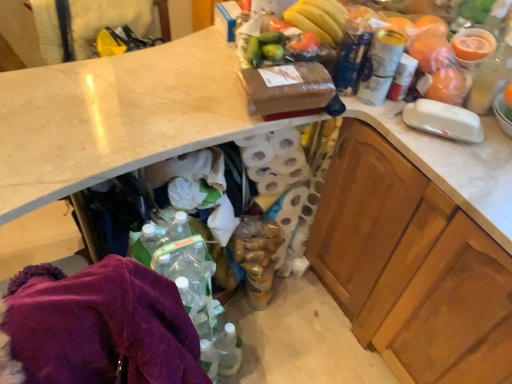
In order to click on metallic silver can at upper right, which is the first bottle from left to right in this screenshot , I will do `click(380, 66)`.

How much space does translucent plastic cup at upper right, arranged as the 1th bottle when viewed from the right, occupy horizontally?

translucent plastic cup at upper right, arranged as the 1th bottle when viewed from the right, is 3.64 inches wide.

Find the location of a particular element. translucent plastic cup at upper right, arranged as the 1th bottle when viewed from the right is located at coordinates (490, 77).

Describe the element at coordinates (318, 19) in the screenshot. The width and height of the screenshot is (512, 384). I see `yellow matte bananas at upper right` at that location.

Find the location of a particular element. metallic silver can at upper right, which is the first bottle from left to right is located at coordinates (380, 66).

Consider the image. Is white marble countertop at lower left facing away from yellow matte bananas at upper right?

No, white marble countertop at lower left's orientation is not away from yellow matte bananas at upper right.

I want to click on banana on the right of white marble countertop at lower left, so [318, 19].

Which is less distant, [251,126] or [329,22]?

The point [251,126] is closer to the camera.

Which of these two, wooden cabinet at right or translucent plastic cup at upper right, arranged as the 1th bottle when viewed from the right, stands shorter?

With less height is translucent plastic cup at upper right, arranged as the 1th bottle when viewed from the right.

Which is correct: wooden cabinet at right is inside translucent plastic cup at upper right, arranged as the 1th bottle when viewed from the right, or outside of it?

wooden cabinet at right is not inside translucent plastic cup at upper right, arranged as the 1th bottle when viewed from the right, it's outside.

Is wooden cabinet at right positioned far away from translucent plastic cup at upper right, arranged as the 1th bottle when viewed from the right?

They are positioned close to each other.

From the image's perspective, is wooden cabinet at right positioned above or below translucent plastic cup at upper right, which is counted as the 2th bottle, starting from the left?

Based on their image positions, wooden cabinet at right is located beneath translucent plastic cup at upper right, which is counted as the 2th bottle, starting from the left.

Locate an element on the screen. The image size is (512, 384). countertop below the translucent plastic cup at upper right, arranged as the 1th bottle when viewed from the right (from the image's perspective) is located at coordinates (117, 117).

Looking at this image, is white marble countertop at lower left oriented towards translucent plastic cup at upper right, which is counted as the 2th bottle, starting from the left?

No, white marble countertop at lower left does not turn towards translucent plastic cup at upper right, which is counted as the 2th bottle, starting from the left.

Measure the distance between white marble countertop at lower left and translucent plastic cup at upper right, arranged as the 1th bottle when viewed from the right.

white marble countertop at lower left is 89.65 centimeters away from translucent plastic cup at upper right, arranged as the 1th bottle when viewed from the right.

In the scene shown: Between translucent plastic cup at upper right, which is counted as the 2th bottle, starting from the left, and yellow matte bananas at upper right, which one has smaller width?

translucent plastic cup at upper right, which is counted as the 2th bottle, starting from the left.

From a real-world perspective, who is located lower, translucent plastic cup at upper right, which is counted as the 2th bottle, starting from the left, or yellow matte bananas at upper right?

From a 3D spatial view, translucent plastic cup at upper right, which is counted as the 2th bottle, starting from the left, is below.

Can you confirm if translucent plastic cup at upper right, arranged as the 1th bottle when viewed from the right, is positioned to the right of yellow matte bananas at upper right?

Yes, translucent plastic cup at upper right, arranged as the 1th bottle when viewed from the right, is to the right of yellow matte bananas at upper right.

From the image's perspective, which one is positioned higher, translucent plastic cup at upper right, which is counted as the 2th bottle, starting from the left, or yellow matte bananas at upper right?

yellow matte bananas at upper right is shown above in the image.

Which is more to the right, white textured toilet paper at center or white marble countertop at lower left?

white textured toilet paper at center is more to the right.

From a real-world perspective, between white textured toilet paper at center and white marble countertop at lower left, who is vertically lower?

white textured toilet paper at center.

Does white textured toilet paper at center turn towards white marble countertop at lower left?

No, white textured toilet paper at center is not turned towards white marble countertop at lower left.

The image size is (512, 384). Find the location of `countertop in front of the white textured toilet paper at center`. countertop in front of the white textured toilet paper at center is located at coordinates (117, 117).

Who is shorter, white textured toilet paper at center or metallic silver can at upper right, arranged as the second bottle when viewed from the right?

With less height is metallic silver can at upper right, arranged as the second bottle when viewed from the right.

In the scene shown: Considering the relative sizes of white textured toilet paper at center and metallic silver can at upper right, arranged as the second bottle when viewed from the right, in the image provided, is white textured toilet paper at center bigger than metallic silver can at upper right, arranged as the second bottle when viewed from the right,?

Correct, white textured toilet paper at center is larger in size than metallic silver can at upper right, arranged as the second bottle when viewed from the right.

Could you tell me if white textured toilet paper at center is turned towards metallic silver can at upper right, arranged as the second bottle when viewed from the right?

No, white textured toilet paper at center is not facing towards metallic silver can at upper right, arranged as the second bottle when viewed from the right.

In the scene shown: Do you think white textured toilet paper at center is within metallic silver can at upper right, which is the first bottle from left to right, or outside of it?

The correct answer is: outside.

Is yellow matte bananas at upper right facing towards white textured toilet paper at center?

No, yellow matte bananas at upper right is not oriented towards white textured toilet paper at center.

Is yellow matte bananas at upper right positioned far away from white textured toilet paper at center?

That's not correct — yellow matte bananas at upper right is a little close to white textured toilet paper at center.

Where is `banana positioned vertically above the white textured toilet paper at center (from a real-world perspective)`? The width and height of the screenshot is (512, 384). banana positioned vertically above the white textured toilet paper at center (from a real-world perspective) is located at coordinates (318, 19).

Between yellow matte bananas at upper right and white textured toilet paper at center, which one has smaller width?

With smaller width is yellow matte bananas at upper right.

At what (x,y) coordinates should I click in order to perform the action: click on banana behind the white marble countertop at lower left. Please return your answer as a coordinate pair (x, y). The height and width of the screenshot is (384, 512). Looking at the image, I should click on (318, 19).

Locate an element on the screen. The width and height of the screenshot is (512, 384). cabinetry that appears below the translucent plastic cup at upper right, which is counted as the 2th bottle, starting from the left (from the image's perspective) is located at coordinates (411, 266).

Considering their positions, is white marble countertop at lower left positioned closer to wooden cabinet at right than metallic silver can at upper right, which is the first bottle from left to right?

The object closer to wooden cabinet at right is metallic silver can at upper right, which is the first bottle from left to right.

When comparing their distances from metallic silver can at upper right, arranged as the second bottle when viewed from the right, does white marble countertop at lower left or white textured toilet paper at center seem further?

white marble countertop at lower left lies further to metallic silver can at upper right, arranged as the second bottle when viewed from the right, than the other object.

Based on their spatial positions, is wooden cabinet at right or yellow matte bananas at upper right further from translucent plastic cup at upper right, arranged as the 1th bottle when viewed from the right?

wooden cabinet at right.

From the image, which object appears to be farther from metallic silver can at upper right, arranged as the second bottle when viewed from the right, white textured toilet paper at center or wooden cabinet at right?

white textured toilet paper at center is positioned further to the anchor metallic silver can at upper right, arranged as the second bottle when viewed from the right.

Estimate the real-world distances between objects in this image. Which object is further from white marble countertop at lower left, metallic silver can at upper right, which is the first bottle from left to right, or translucent plastic cup at upper right, which is counted as the 2th bottle, starting from the left?

The object further to white marble countertop at lower left is translucent plastic cup at upper right, which is counted as the 2th bottle, starting from the left.

When comparing their distances from metallic silver can at upper right, arranged as the second bottle when viewed from the right, does wooden cabinet at right or translucent plastic cup at upper right, arranged as the 1th bottle when viewed from the right, seem closer?

translucent plastic cup at upper right, arranged as the 1th bottle when viewed from the right.

When comparing their distances from metallic silver can at upper right, which is the first bottle from left to right, does translucent plastic cup at upper right, arranged as the 1th bottle when viewed from the right, or wooden cabinet at right seem further?

wooden cabinet at right.

Estimate the real-world distances between objects in this image. Which object is closer to wooden cabinet at right, white textured toilet paper at center or white marble countertop at lower left?

The object closer to wooden cabinet at right is white textured toilet paper at center.

I want to click on bottle situated between white marble countertop at lower left and translucent plastic cup at upper right, arranged as the 1th bottle when viewed from the right, from left to right, so click(x=380, y=66).

At what (x,y) coordinates should I click in order to perform the action: click on bottle situated between white marble countertop at lower left and wooden cabinet at right from left to right. Please return your answer as a coordinate pair (x, y). Image resolution: width=512 pixels, height=384 pixels. Looking at the image, I should click on (380, 66).

The image size is (512, 384). What are the coordinates of `banana situated between white marble countertop at lower left and wooden cabinet at right from left to right` in the screenshot? It's located at (318, 19).

Where is `bottle between metallic silver can at upper right, arranged as the second bottle when viewed from the right, and wooden cabinet at right in the up-down direction`? bottle between metallic silver can at upper right, arranged as the second bottle when viewed from the right, and wooden cabinet at right in the up-down direction is located at coordinates (490, 77).